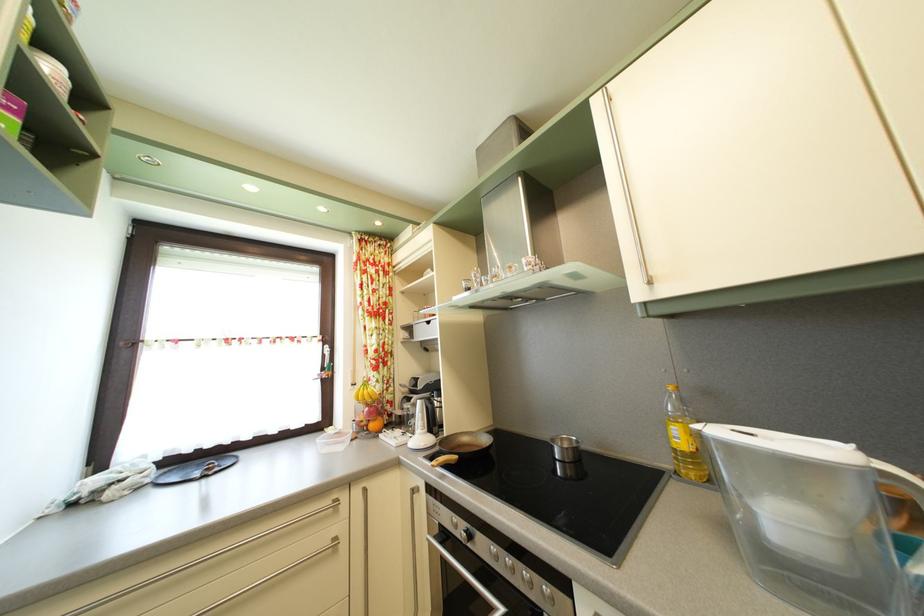
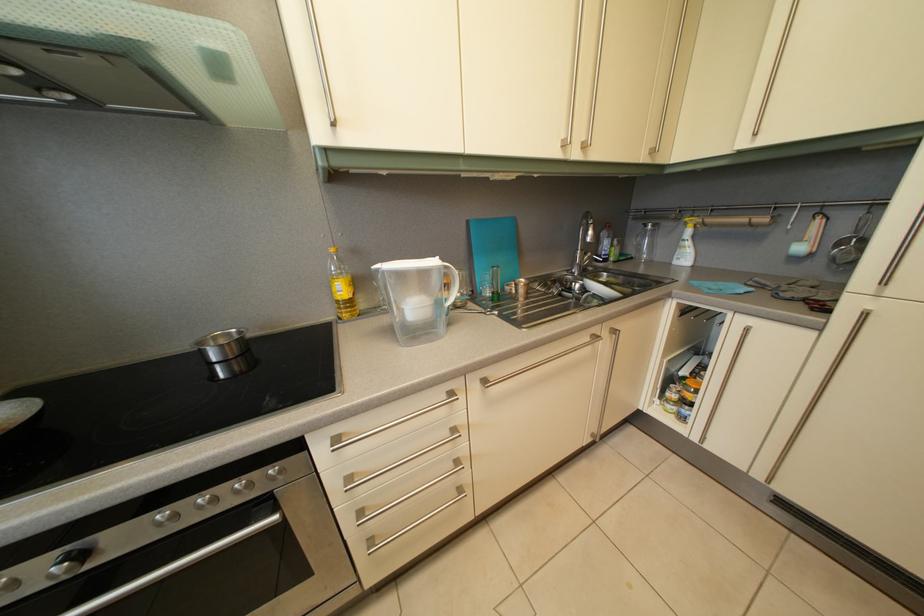
Where in the second image is the point corresponding to [464,525] from the first image?

(8, 586)